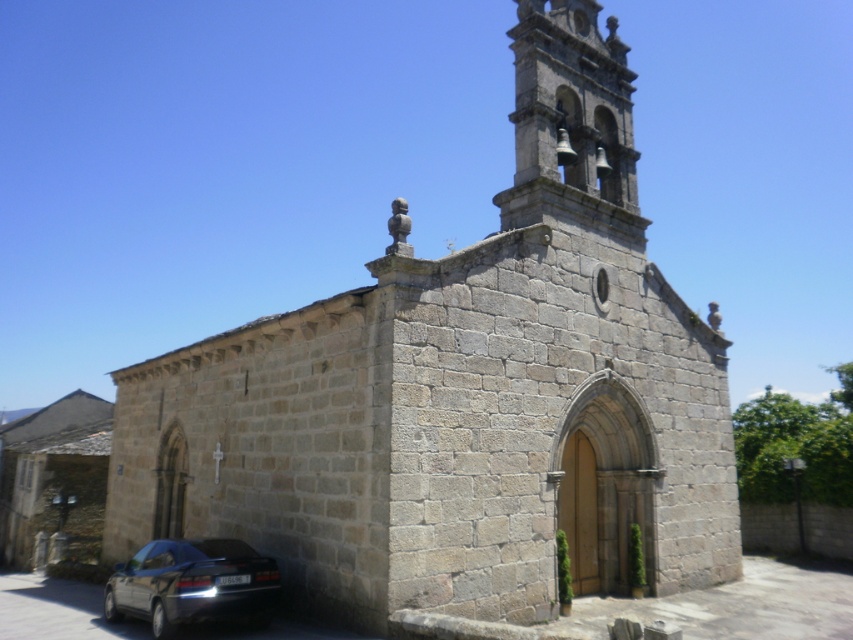
Consider the image. Between gray stone bell tower at upper right and dark gray metallic car at lower left, which one is positioned lower?

dark gray metallic car at lower left is lower down.

Is gray stone bell tower at upper right to the left of dark gray metallic car at lower left from the viewer's perspective?

No, gray stone bell tower at upper right is not to the left of dark gray metallic car at lower left.

Which is behind, point (561, 8) or point (165, 609)?

The point (561, 8) is behind.

Identify the location of gray stone bell tower at upper right. The width and height of the screenshot is (853, 640). (572, 109).